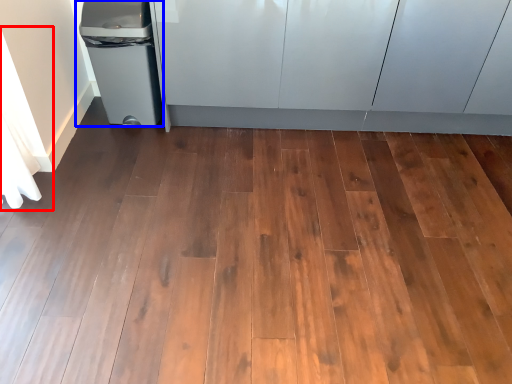
Question: Which point is closer to the camera, curtain (highlighted by a red box) or waste container (highlighted by a blue box)?

Choices:
 (A) curtain
 (B) waste container

Answer: (A)